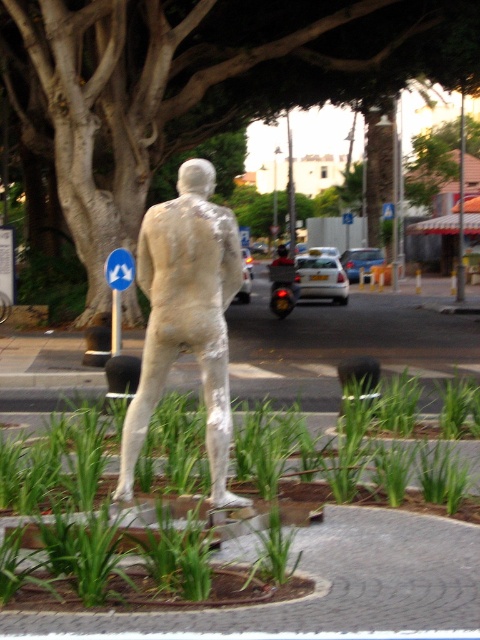
Question: Which object appears closest to the camera in this image?

Choices:
 (A) blue plastic sign at upper left
 (B) green leafy tree at upper center
 (C) white plaster figure at center

Answer: (C)

Question: Estimate the real-world distances between objects in this image. Which object is farther from the white plaster figure at center?

Choices:
 (A) blue plastic sign at upper left
 (B) green leafy tree at upper center

Answer: (B)

Question: Is white plaster figure at center further to camera compared to blue plastic sign at upper left?

Choices:
 (A) no
 (B) yes

Answer: (A)

Question: Which point is closer to the camera?

Choices:
 (A) green leafy tree at upper center
 (B) white plaster figure at center

Answer: (B)

Question: Can you confirm if green leafy tree at upper center is positioned to the right of white plaster figure at center?

Choices:
 (A) no
 (B) yes

Answer: (B)

Question: Can you confirm if green leafy tree at upper center is bigger than white plaster figure at center?

Choices:
 (A) no
 (B) yes

Answer: (B)